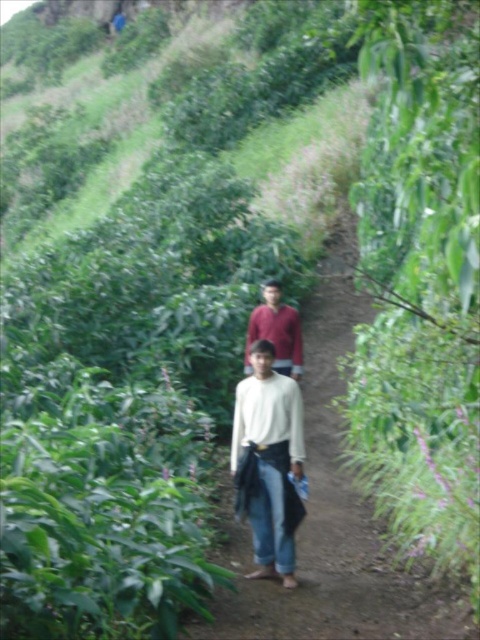
Question: Does white fabric at center have a larger size compared to white matte shirt at center?

Choices:
 (A) yes
 (B) no

Answer: (A)

Question: Which object is closer to the camera taking this photo?

Choices:
 (A) matte red shirt at center
 (B) white matte shirt at center
 (C) white fabric at center

Answer: (C)

Question: Which object appears farthest from the camera in this image?

Choices:
 (A) matte red shirt at center
 (B) white fabric at center

Answer: (A)

Question: Which point appears closest to the camera in this image?

Choices:
 (A) (251, 522)
 (B) (265, 310)
 (C) (333, 358)

Answer: (A)

Question: Can you confirm if white fabric at center is positioned below white matte shirt at center?

Choices:
 (A) no
 (B) yes

Answer: (A)

Question: Can you confirm if white fabric at center is positioned below matte red shirt at center?

Choices:
 (A) yes
 (B) no

Answer: (B)